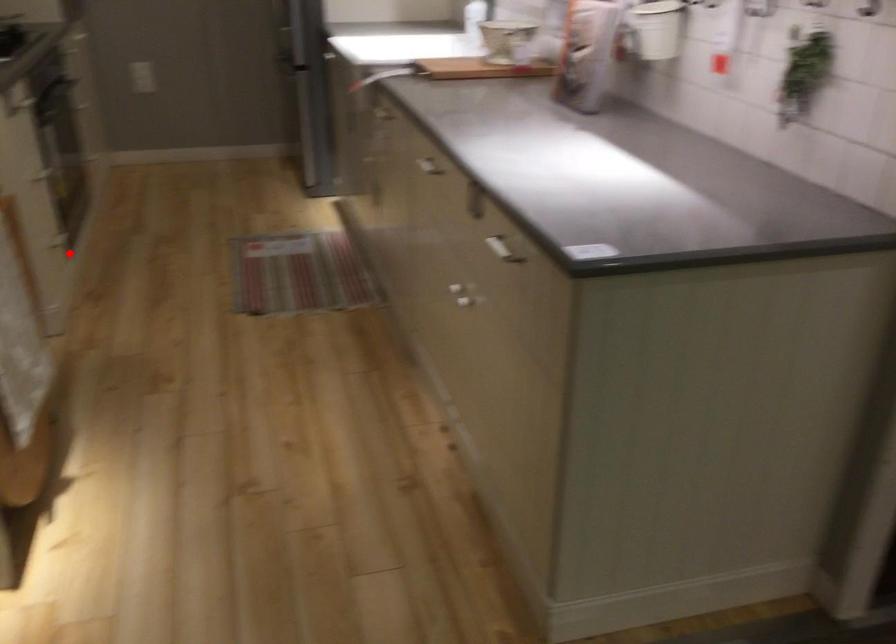
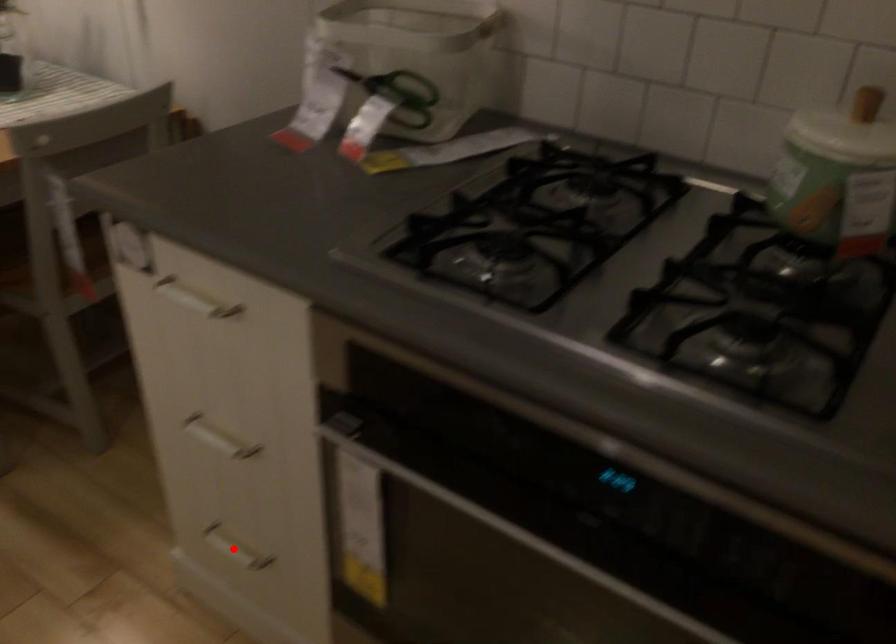
I am providing you with two images of the same scene from different viewpoints. A red point is marked on the first image and another point is marked on the second image. Does the point marked in image1 correspond to the same location as the one in image2?

Yes